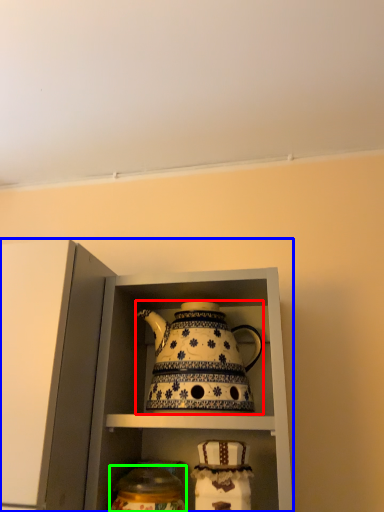
Question: Estimate the real-world distances between objects in this image. Which object is closer to kettle (highlighted by a red box), cabinetry (highlighted by a blue box) or tableware (highlighted by a green box)?

Choices:
 (A) cabinetry
 (B) tableware

Answer: (A)